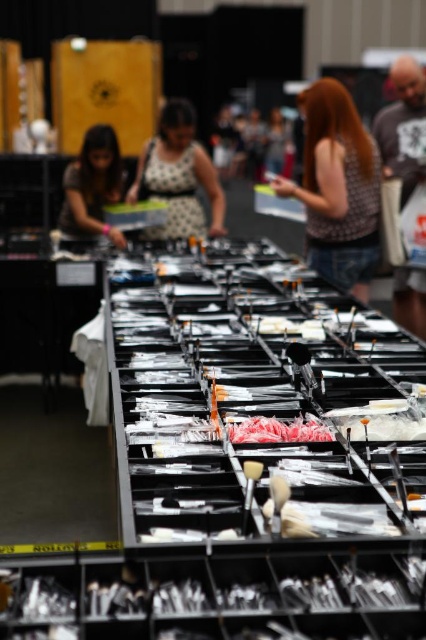
Question: In this image, where is plaid shirt at upper center located relative to bald man at upper right?

Choices:
 (A) below
 (B) above

Answer: (A)

Question: Which of the following is the closest to the observer?

Choices:
 (A) polka dot dress at center
 (B) bald man at upper right

Answer: (B)

Question: Which of the following is the farthest from the observer?

Choices:
 (A) 184,120
 (B) 322,97
 (C) 290,428
 (D) 121,236

Answer: (A)

Question: Where is plaid shirt at upper center located in relation to bald man at upper right in the image?

Choices:
 (A) right
 (B) left

Answer: (B)

Question: Does matte black laptop at left appear on the left side of pink glossy candy at center?

Choices:
 (A) yes
 (B) no

Answer: (A)

Question: Estimate the real-world distances between objects in this image. Which object is farther from the bald man at upper right?

Choices:
 (A) plaid shirt at upper center
 (B) polka dot dress at center
 (C) matte black laptop at left

Answer: (C)